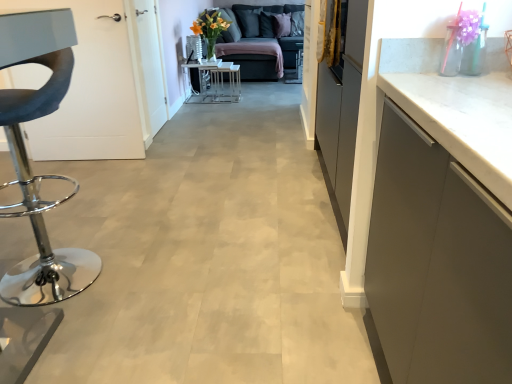
Question: Is dark gray fabric couch at upper center thinner than metallic silver table at center?

Choices:
 (A) no
 (B) yes

Answer: (A)

Question: Does dark gray fabric couch at upper center have a greater width compared to metallic silver table at center?

Choices:
 (A) yes
 (B) no

Answer: (A)

Question: Considering the relative sizes of dark gray fabric couch at upper center and metallic silver table at center in the image provided, is dark gray fabric couch at upper center taller than metallic silver table at center?

Choices:
 (A) yes
 (B) no

Answer: (A)

Question: Would you say dark gray fabric couch at upper center is a long distance from metallic silver table at center?

Choices:
 (A) yes
 (B) no

Answer: (B)

Question: Does dark gray fabric couch at upper center lie behind metallic silver table at center?

Choices:
 (A) yes
 (B) no

Answer: (A)

Question: From the image's perspective, relative to metallic silver table at center, is dark gray fabric couch at upper center above or below?

Choices:
 (A) below
 (B) above

Answer: (B)

Question: Looking at the image, does dark gray fabric couch at upper center seem bigger or smaller compared to metallic silver table at center?

Choices:
 (A) small
 (B) big

Answer: (B)

Question: Is dark gray fabric couch at upper center spatially inside metallic silver table at center, or outside of it?

Choices:
 (A) outside
 (B) inside

Answer: (A)

Question: From a real-world perspective, relative to metallic silver table at center, is dark gray fabric couch at upper center vertically above or below?

Choices:
 (A) above
 (B) below

Answer: (A)

Question: Visually, is metallic silver table at center positioned to the left or to the right of metallic chrome stool at left?

Choices:
 (A) left
 (B) right

Answer: (B)

Question: Considering the positions of metallic silver table at center and metallic chrome stool at left in the image, is metallic silver table at center wider or thinner than metallic chrome stool at left?

Choices:
 (A) wide
 (B) thin

Answer: (B)

Question: Do you think metallic silver table at center is within metallic chrome stool at left, or outside of it?

Choices:
 (A) inside
 (B) outside

Answer: (B)

Question: Does point (202, 66) appear closer or farther from the camera than point (57, 279)?

Choices:
 (A) closer
 (B) farther

Answer: (B)

Question: In terms of width, does metallic chrome stool at left look wider or thinner when compared to dark gray fabric couch at upper center?

Choices:
 (A) thin
 (B) wide

Answer: (A)

Question: Does point (27, 109) appear closer or farther from the camera than point (249, 41)?

Choices:
 (A) farther
 (B) closer

Answer: (B)